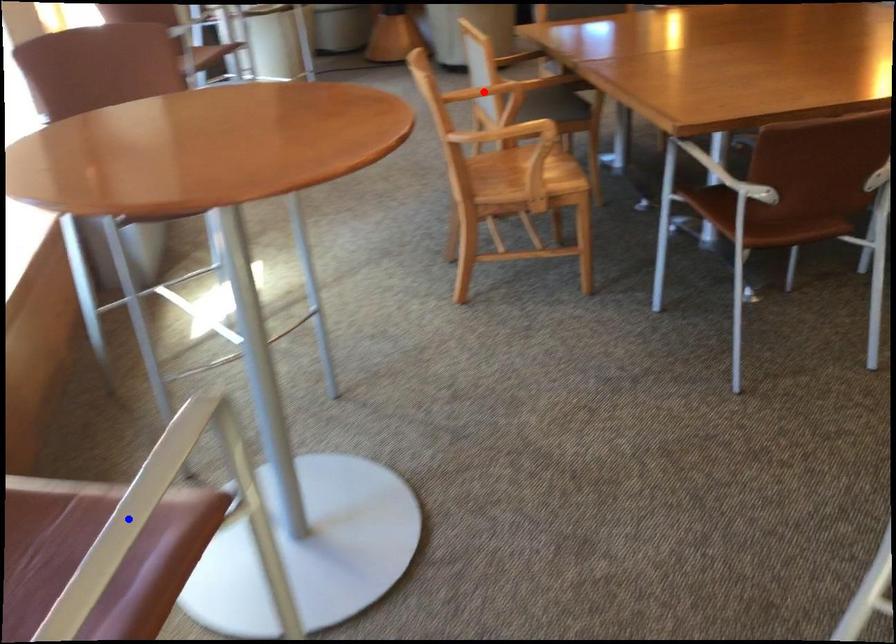
Question: Which of the two points in the image is closer to the camera?

Choices:
 (A) Blue point is closer.
 (B) Red point is closer.

Answer: (A)